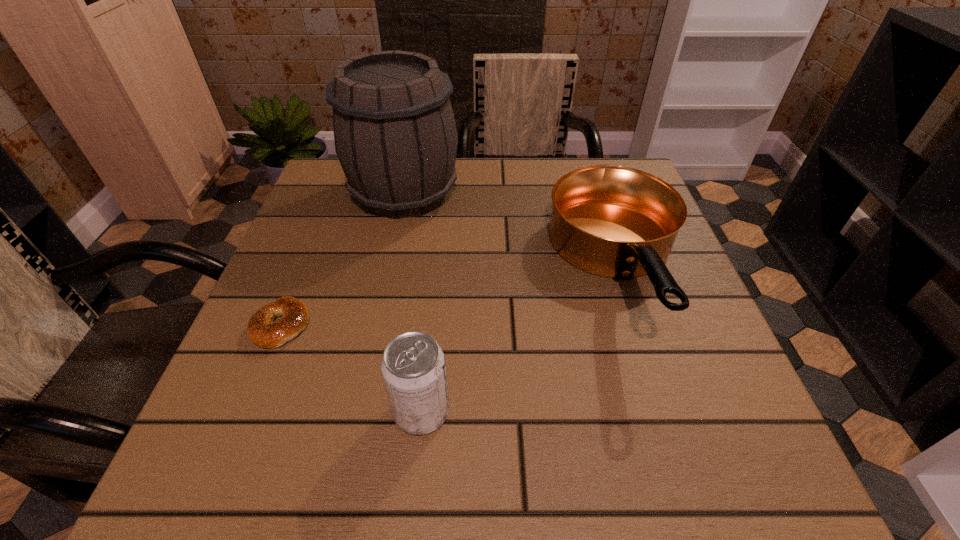
Where is `the tallest object`? Image resolution: width=960 pixels, height=540 pixels. the tallest object is located at coordinates (395, 135).

The width and height of the screenshot is (960, 540). What are the coordinates of `the rightmost object` in the screenshot? It's located at pyautogui.click(x=613, y=221).

This screenshot has width=960, height=540. What are the coordinates of `the nearest object` in the screenshot? It's located at (413, 368).

The width and height of the screenshot is (960, 540). Find the location of `the shortest object`. the shortest object is located at coordinates (261, 330).

The width and height of the screenshot is (960, 540). Identify the location of free space located 0.260m on the right of the tallest object. (566, 193).

Where is `vacant space located on the handle side of the rightmost object`? This screenshot has width=960, height=540. vacant space located on the handle side of the rightmost object is located at coordinates (666, 422).

Find the location of `vacant point located on the right of the soda can`. vacant point located on the right of the soda can is located at coordinates (621, 411).

This screenshot has width=960, height=540. I want to click on vacant space situated on the right of the shortest object, so 489,325.

Locate an element on the screen. wine bucket that is at the far edge is located at coordinates (395, 135).

This screenshot has height=540, width=960. Find the location of `frying pan at the far edge`. frying pan at the far edge is located at coordinates (613, 221).